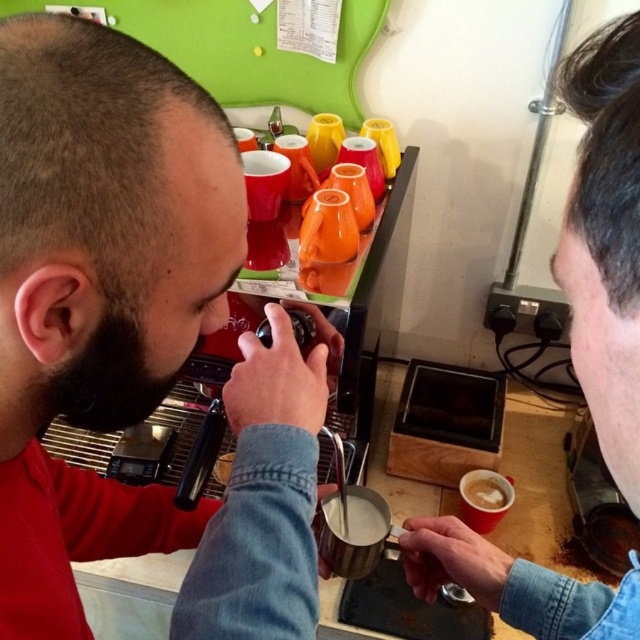
Which is above, black beard at left or white frothy milk at center?

black beard at left

Measure the distance between black beard at left and camera.

black beard at left and camera are 15.50 inches apart from each other.

Who is more distant from viewer, (99,323) or (365,513)?

The point (365,513) is more distant.

Image resolution: width=640 pixels, height=640 pixels. Identify the location of black beard at left. (108, 376).

Can you confirm if matte black espresso machine at center is taller than matte black coffee cup at right?

No.

At what (x,y) coordinates should I click in order to perform the action: click on matte black espresso machine at center. Please return your answer as a coordinate pair (x, y). The width and height of the screenshot is (640, 640). Looking at the image, I should click on (136, 339).

Can you confirm if matte black coffee cup at right is positioned to the right of white frothy milk at center?

Correct, you'll find matte black coffee cup at right to the right of white frothy milk at center.

Does matte black coffee cup at right have a lesser height compared to white frothy milk at center?

Incorrect, matte black coffee cup at right's height does not fall short of white frothy milk at center's.

The height and width of the screenshot is (640, 640). Identify the location of matte black coffee cup at right. (605, 241).